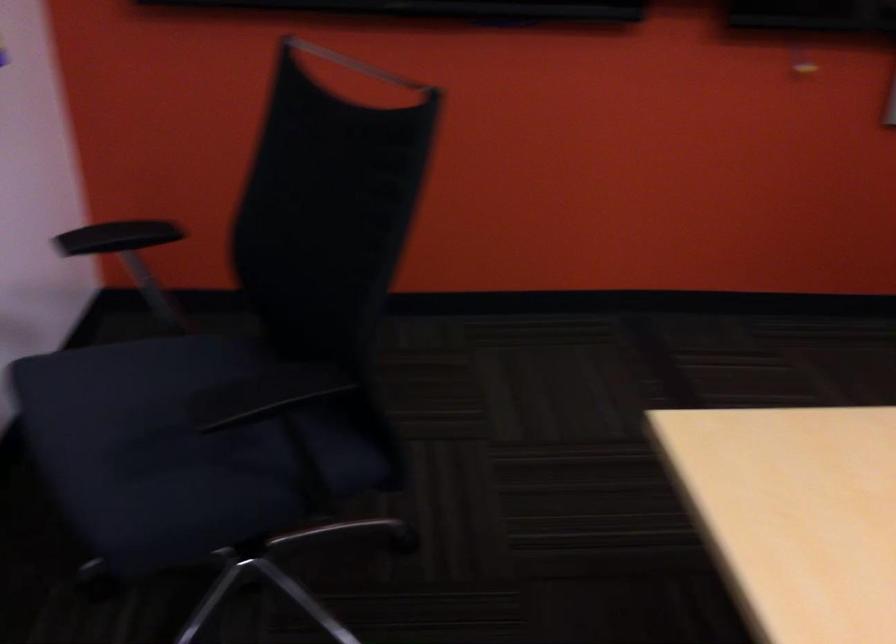
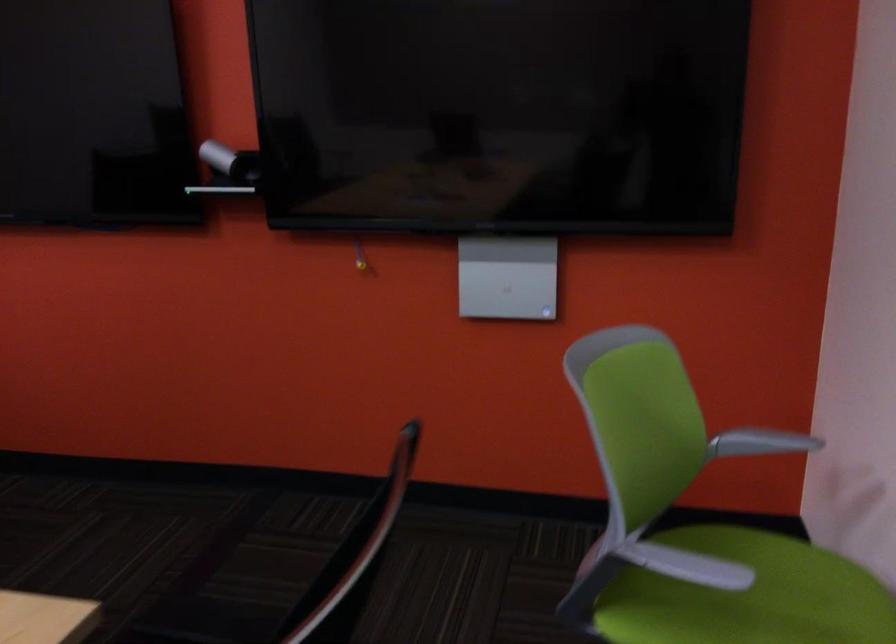
Question: Which direction would the cameraman need to move to produce the second image? Reply with the corresponding letter.

Choices:
 (A) Left
 (B) Right
 (C) Forward
 (D) Backward

Answer: (B)